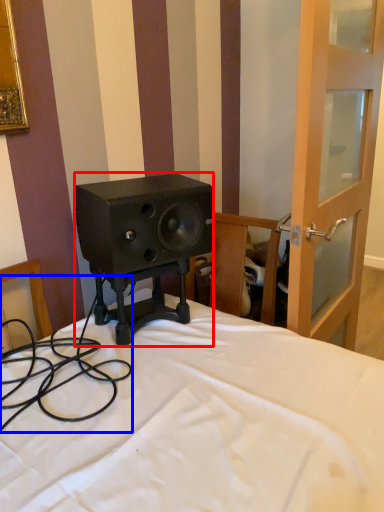
Question: Which of the following is the farthest to the observer, loudspeaker (highlighted by a red box) or cable (highlighted by a blue box)?

Choices:
 (A) loudspeaker
 (B) cable

Answer: (A)